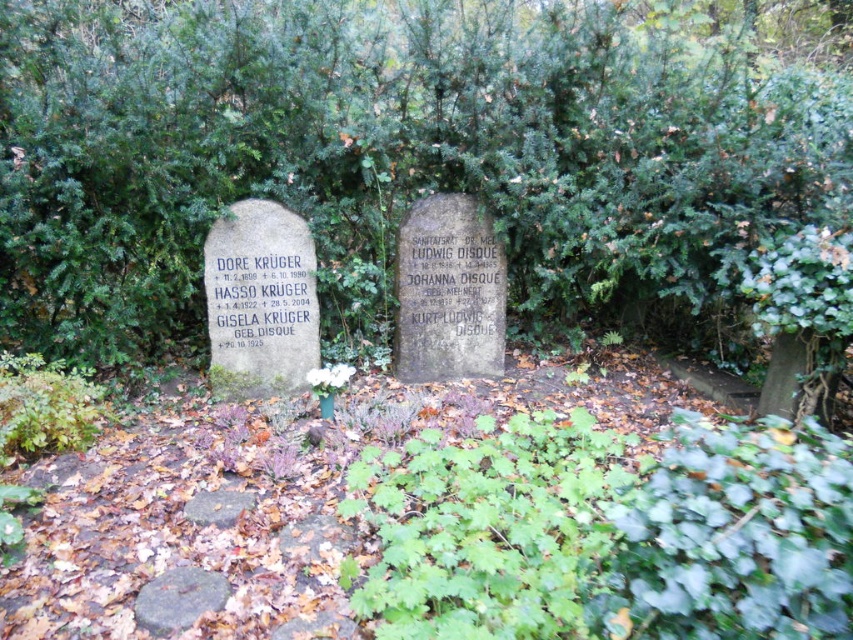
Question: Is the position of green stone at lower left more distant than that of white matte flower at center?

Choices:
 (A) yes
 (B) no

Answer: (B)

Question: Which point is closer to the camera?

Choices:
 (A) green stone at lower left
 (B) white matte flower at center
 (C) green leafy tree at center
 (D) gray stone at center

Answer: (A)

Question: Which point is closer to the camera?

Choices:
 (A) gray stone gravestone at center
 (B) gray stone at center

Answer: (B)

Question: From the image, what is the correct spatial relationship of gray stone gravestone at center in relation to white matte flower at center?

Choices:
 (A) right
 (B) left

Answer: (A)

Question: Is green leafy tree at center thinner than gray stone at center?

Choices:
 (A) no
 (B) yes

Answer: (A)

Question: Which of the following is the closest to the observer?

Choices:
 (A) green leafy tree at center
 (B) gray stone gravestone at center

Answer: (A)